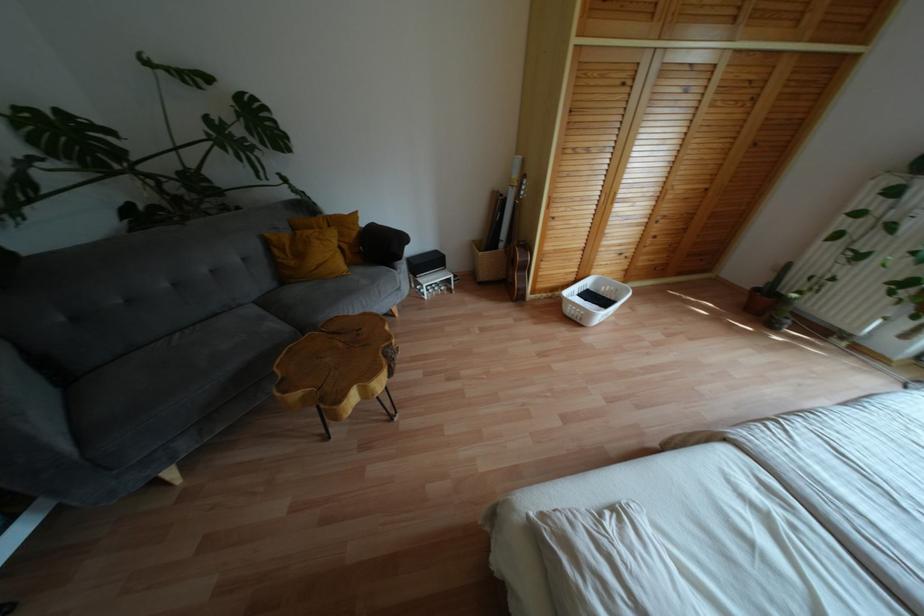
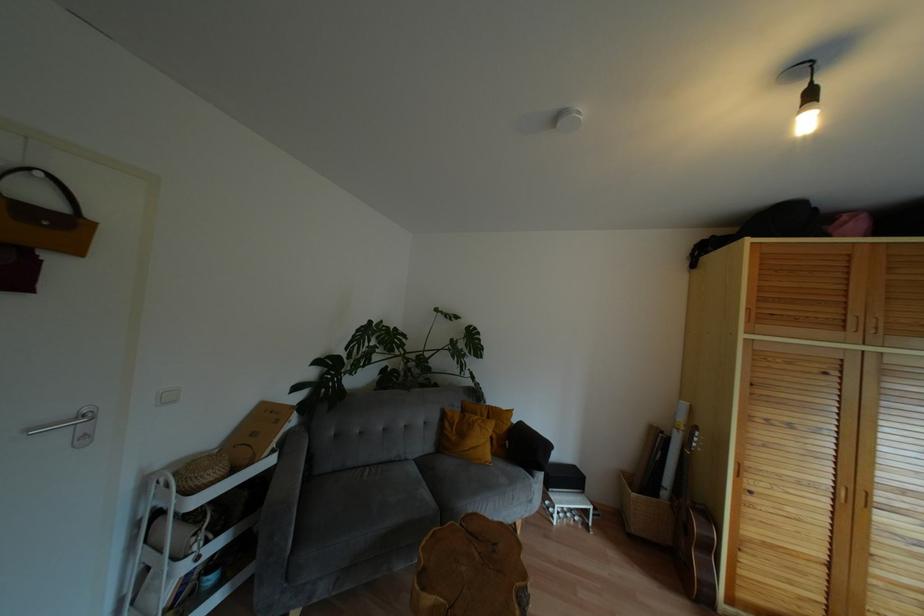
The point at (482, 275) is marked in the first image. Where is the corresponding point in the second image?

(636, 527)